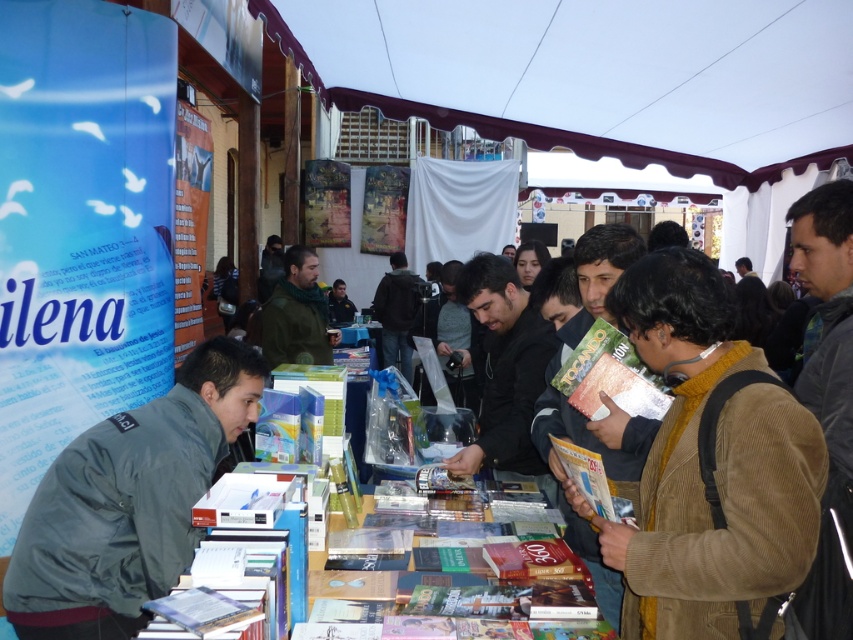
Question: Where is dark gray jacket at lower left located in relation to green corduroy jacket at center in the image?

Choices:
 (A) left
 (B) right

Answer: (B)

Question: Considering the real-world distances, which object is closest to the dark gray jacket at lower left?

Choices:
 (A) green corduroy jacket at center
 (B) brown corduroy jacket at center
 (C) black matte jacket at center
 (D) dark brown leather jacket at center

Answer: (C)

Question: Based on their relative distances, which object is nearer to the dark gray jacket at lower left?

Choices:
 (A) green corduroy jacket at center
 (B) black matte jacket at center
 (C) brown corduroy jacket at center

Answer: (B)

Question: Does brown corduroy jacket at center have a lesser width compared to green corduroy jacket at center?

Choices:
 (A) no
 (B) yes

Answer: (B)

Question: Considering the relative positions of black matte jacket at center and dark brown leather jacket at center in the image provided, where is black matte jacket at center located with respect to dark brown leather jacket at center?

Choices:
 (A) left
 (B) right

Answer: (B)

Question: Among these points, which one is nearest to the camera?

Choices:
 (A) (392, 275)
 (B) (132, 419)
 (C) (544, 403)
 (D) (515, 276)

Answer: (B)